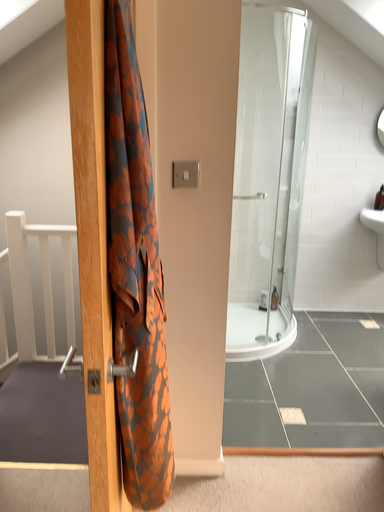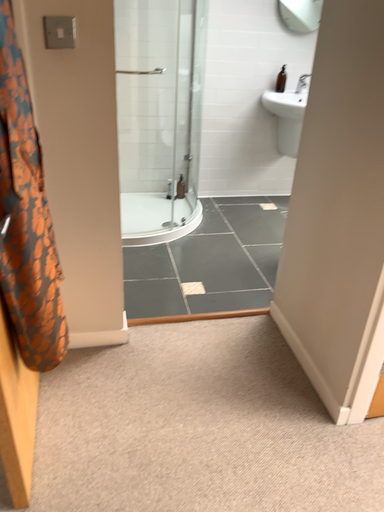
Question: How did the camera likely rotate when shooting the video?

Choices:
 (A) rotated left
 (B) rotated right

Answer: (B)